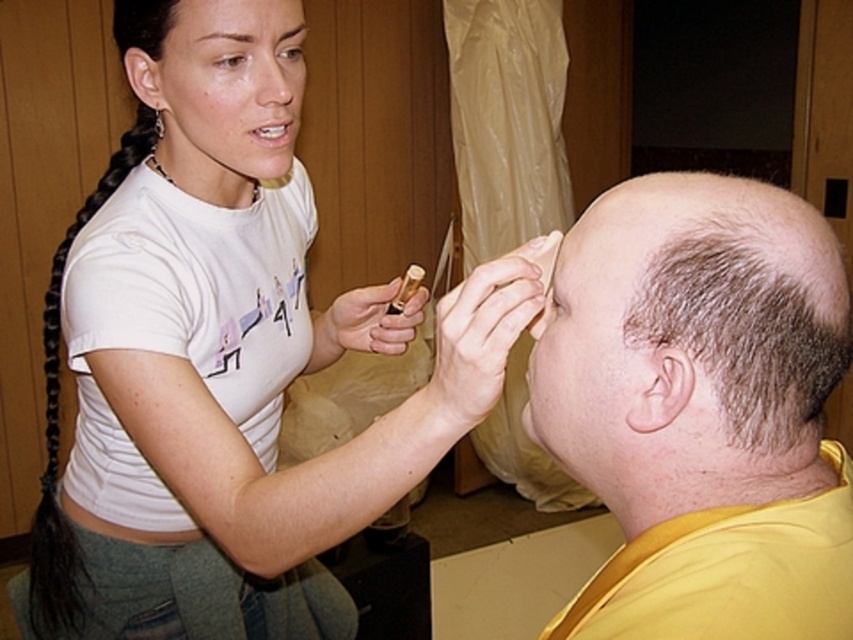
You are a makeup artist who needs to apply eyeliner to both the bald head at upper right and the dark brown hair at upper center. Given that the distance between them is 22.62 inches, can you reach both areas comfortably with your 18 inch long eyeliner brush?

The distance between the bald head at upper right and the dark brown hair at upper center is 22.62 inches. Since the eyeliner brush is only 18 inches long, you cannot comfortably reach both areas without moving closer or adjusting your position.